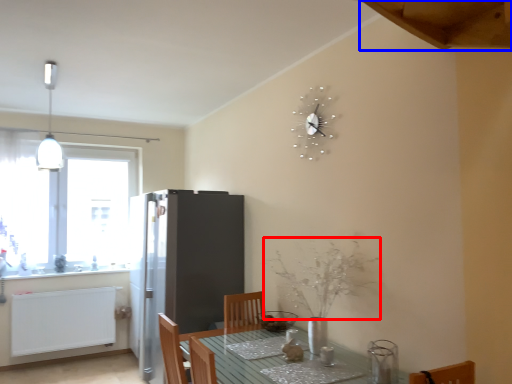
Question: Which object is closer to the camera taking this photo, flower (highlighted by a red box) or exhaust hood (highlighted by a blue box)?

Choices:
 (A) flower
 (B) exhaust hood

Answer: (B)